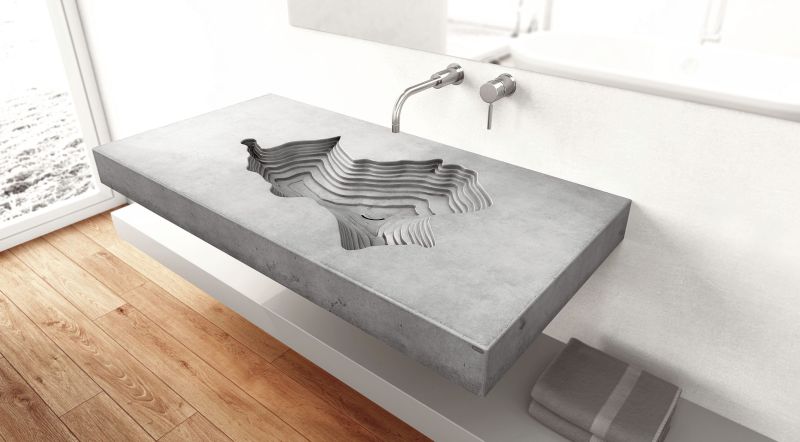
Identify the location of white ledge. (294, 350).